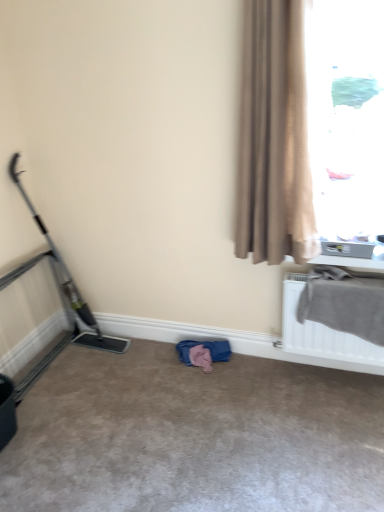
Question: Considering the positions of beige carpet at center and gray fabric at upper right in the image, is beige carpet at center bigger or smaller than gray fabric at upper right?

Choices:
 (A) big
 (B) small

Answer: (A)

Question: Is point (301, 477) positioned closer to the camera than point (284, 297)?

Choices:
 (A) farther
 (B) closer

Answer: (B)

Question: Based on their relative distances, which object is nearer to the translucent glass window at upper right?

Choices:
 (A) gray fabric at upper right
 (B) beige carpet at center
 (C) metallic gray baby carriage at left
 (D) beige textured curtain at right

Answer: (D)

Question: Considering the real-world distances, which object is closest to the translucent glass window at upper right?

Choices:
 (A) metallic gray baby carriage at left
 (B) gray fabric at upper right
 (C) beige carpet at center
 (D) beige textured curtain at right

Answer: (D)